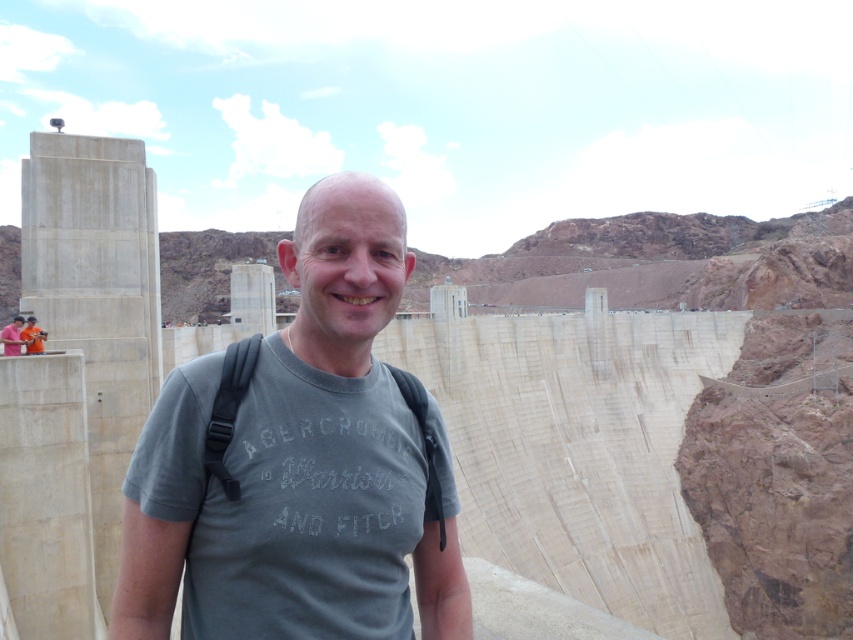
Who is more forward, (315,294) or (21,316)?

Positioned in front is point (315,294).

Between gray cotton t-shirt at center and pink fabric at upper left, which one has less height?

pink fabric at upper left

What do you see at coordinates (329, 456) in the screenshot?
I see `gray cotton t-shirt at center` at bounding box center [329, 456].

Locate an element on the screen. This screenshot has height=640, width=853. gray cotton t-shirt at center is located at coordinates (329, 456).